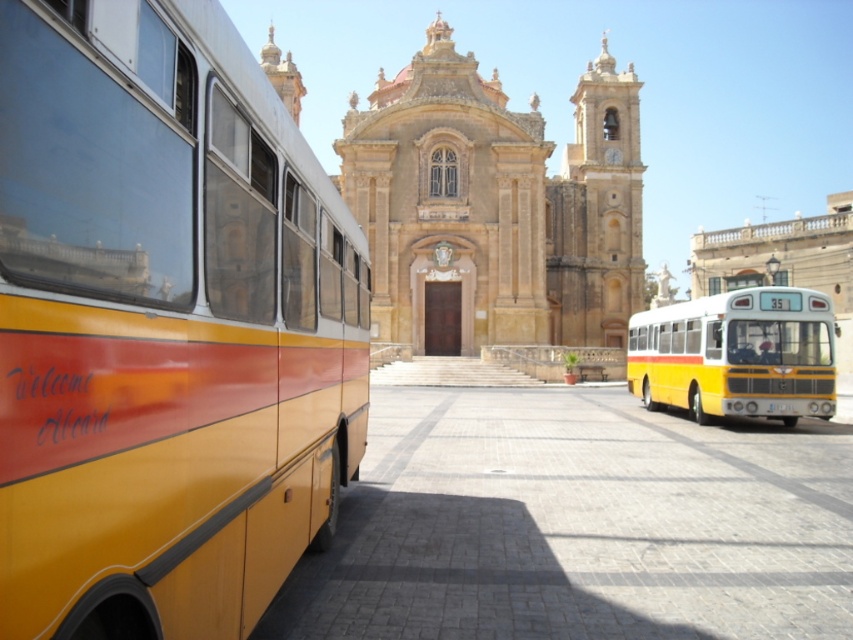
You are a tour guide leading a group to the cathedral. You notice the yellow matte bus at left and the golden stone cathedral at center. Which one is narrower in width?

The yellow matte bus at left is thinner than the golden stone cathedral at center, so the yellow matte bus at left is narrower in width.

You are a tour guide standing in front of the grand historic church. You notice two yellow matte buses parked nearby. Which bus has a smaller width between the yellow matte bus at left and the yellow matte bus at center?

The yellow matte bus at left has a lesser width compared to the yellow matte bus at center.

You are a tourist standing in front of the golden stone cathedral at center and want to take a photo of the yellow matte bus at left without any obstructions. Since the cathedral is large, will you need to move to your left or right to get a clear shot?

Since the yellow matte bus at left is to the left of the golden stone cathedral at center, you need to move to your right to position yourself away from the cathedral and get a clear view of the bus without obstructions.